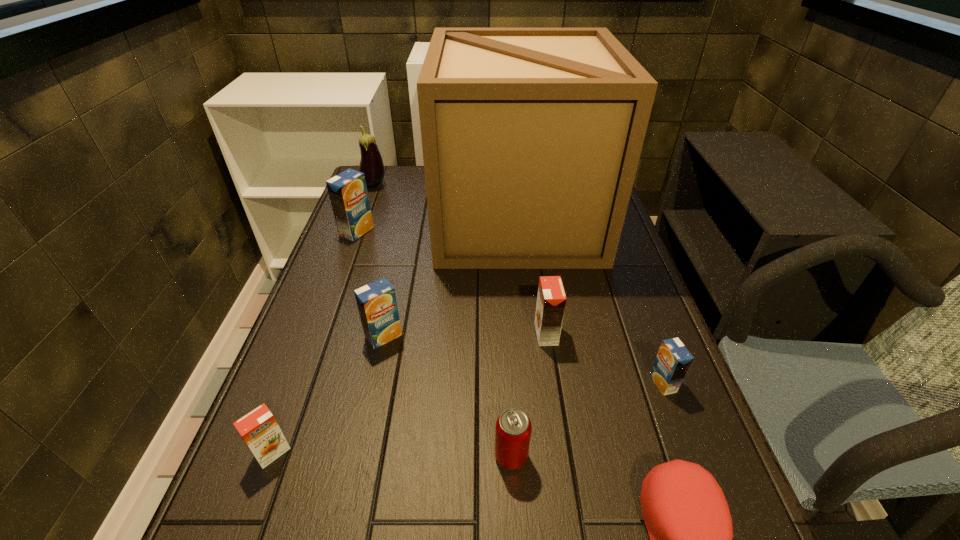
Locate an element on the screen. object identified as the third closest to the eggplant is located at coordinates (377, 304).

At what (x,y) coordinates should I click in order to perform the action: click on object that is the eighth closest to the seventh shortest object. Please return your answer as a coordinate pair (x, y). Looking at the image, I should click on (687, 517).

Find the location of a particular element. The height and width of the screenshot is (540, 960). orange juice that is the second closest to the smaller orange orange juice is located at coordinates (551, 300).

Select which orange juice appears as the closest to the can. Please provide its 2D coordinates. Your answer should be formatted as a tuple, i.e. [(x, y)], where the tuple contains the x and y coordinates of a point satisfying the conditions above.

[(551, 300)]

Locate an element on the screen. Image resolution: width=960 pixels, height=540 pixels. blue orange_juice that stands as the second closest to the cap is located at coordinates (377, 304).

Select which blue orange_juice is the third closest to the right orange orange juice. Please provide its 2D coordinates. Your answer should be formatted as a tuple, i.e. [(x, y)], where the tuple contains the x and y coordinates of a point satisfying the conditions above.

[(348, 194)]

This screenshot has height=540, width=960. What are the coordinates of `free space that satisfies the following two spatial constraints: 1. on the reinforced sides of the fourth farthest orange juice; 2. on the left side of the tallest object` in the screenshot? It's located at (536, 383).

Locate an element on the screen. Image resolution: width=960 pixels, height=540 pixels. vacant space that satisfies the following two spatial constraints: 1. on the back side of the second nearest orange juice; 2. on the left side of the can is located at coordinates (507, 383).

Locate an element on the screen. Image resolution: width=960 pixels, height=540 pixels. free spot that satisfies the following two spatial constraints: 1. on the front side of the nearer orange orange juice; 2. on the right side of the can is located at coordinates (271, 456).